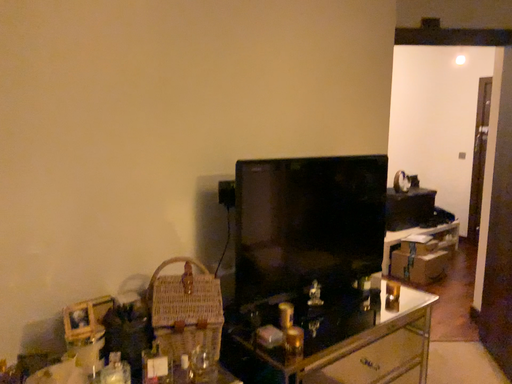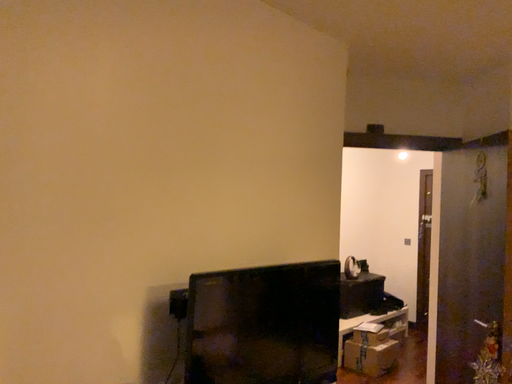
Question: Which way did the camera rotate in the video?

Choices:
 (A) rotated downward
 (B) rotated upward

Answer: (B)